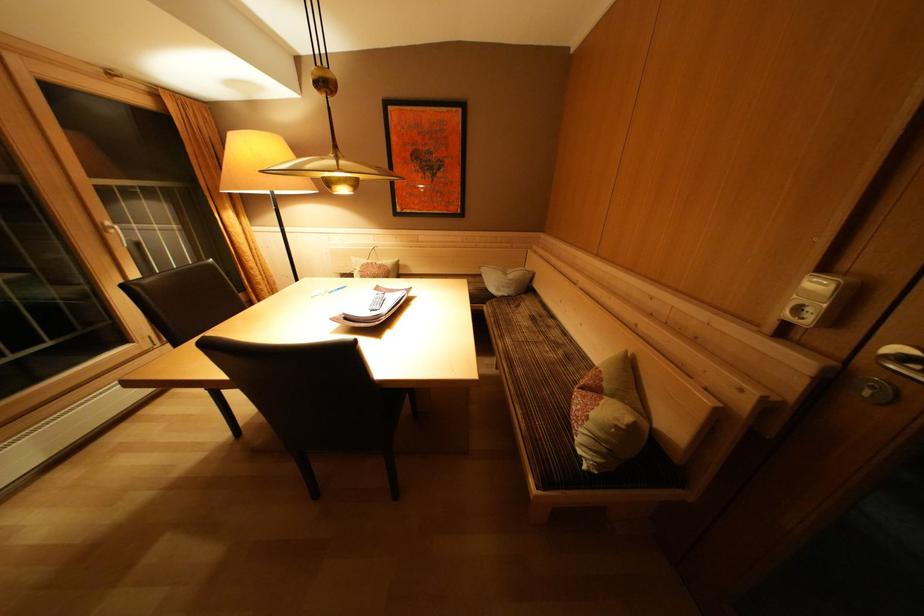
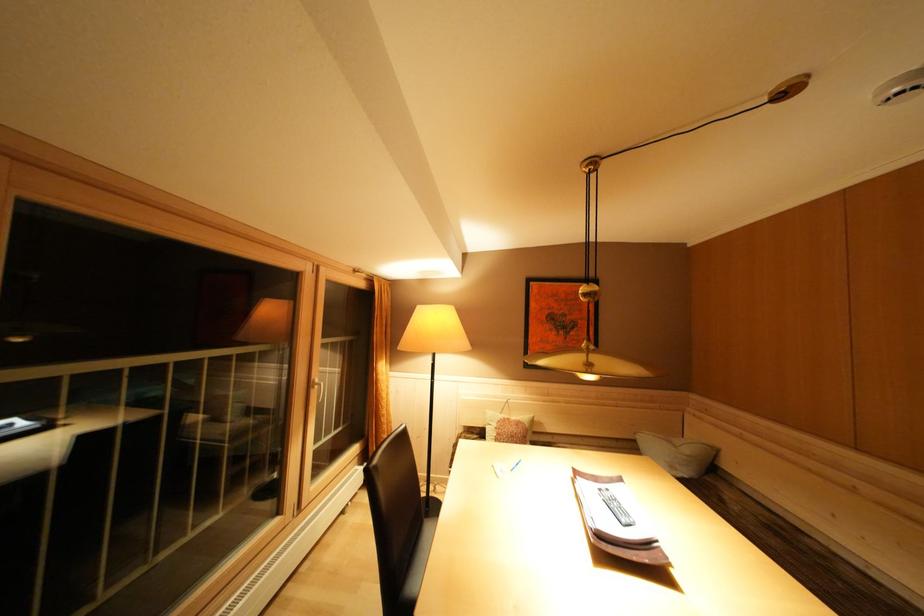
Question: What movement of the cameraman would produce the second image?

Choices:
 (A) Left
 (B) Right
 (C) Forward
 (D) Backward

Answer: (A)